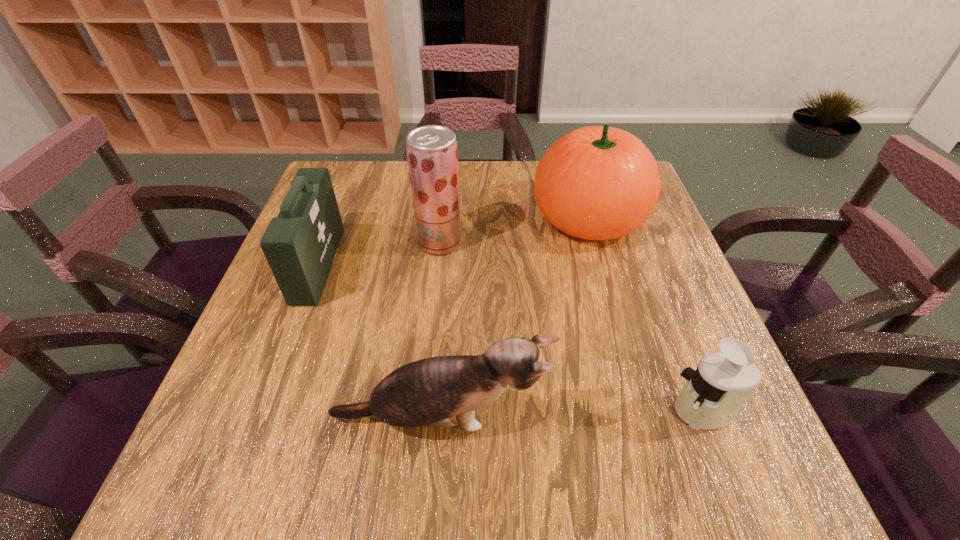
The height and width of the screenshot is (540, 960). In the image, there is a desktop. In order to click on vacant space at the near left corner in this screenshot , I will do `click(210, 448)`.

In the image, there is a desktop. Where is `vacant space at the near right corner`? vacant space at the near right corner is located at coordinates (678, 477).

I want to click on vacant area that lies between the cat and the leftmost object, so click(379, 341).

Locate an element on the screen. The height and width of the screenshot is (540, 960). free space that is in between the juicer and the first-aid kit is located at coordinates (511, 338).

At what (x,y) coordinates should I click in order to perform the action: click on free space between the pumpkin and the cat. Please return your answer as a coordinate pair (x, y). Looking at the image, I should click on (514, 318).

This screenshot has height=540, width=960. Find the location of `free spot between the pumpkin and the cat`. free spot between the pumpkin and the cat is located at coordinates (514, 318).

The width and height of the screenshot is (960, 540). Find the location of `vacant space in between the cat and the fruit juice`. vacant space in between the cat and the fruit juice is located at coordinates (440, 330).

The image size is (960, 540). I want to click on empty space between the pumpkin and the cat, so click(x=514, y=318).

Find the location of `vacant space that is in between the cat and the pumpkin`. vacant space that is in between the cat and the pumpkin is located at coordinates (514, 318).

What are the coordinates of `unoccupied position between the first-aid kit and the fruit juice` in the screenshot? It's located at (379, 253).